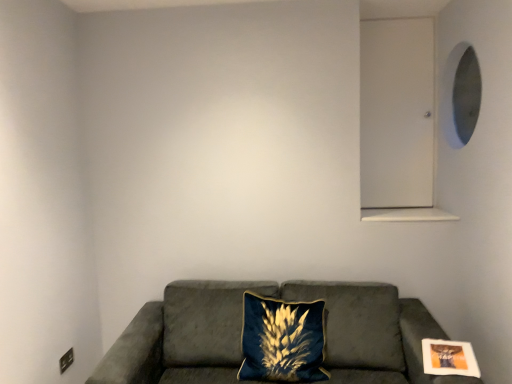
Question: Does point (393, 334) appear closer or farther from the camera than point (313, 324)?

Choices:
 (A) closer
 (B) farther

Answer: (B)

Question: Which is correct: suede couch at lower center is inside velvet blue pillow at center, or outside of it?

Choices:
 (A) outside
 (B) inside

Answer: (A)

Question: Based on their relative distances, which object is farther from the velvet blue pillow at center?

Choices:
 (A) matte white picture frame at lower right
 (B) suede couch at lower center

Answer: (A)

Question: Which object is positioned farthest from the matte white picture frame at lower right?

Choices:
 (A) suede couch at lower center
 (B) velvet blue pillow at center

Answer: (B)